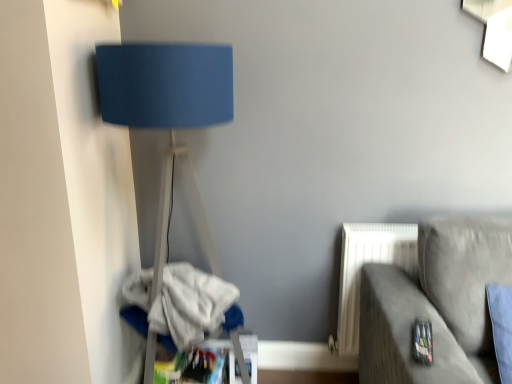
Question: Should I look upward or downward to see white cotton laundry at lower left?

Choices:
 (A) down
 (B) up

Answer: (A)

Question: Considering the relative positions of suede gray couch at lower right and matte blue lampshade at left in the image provided, is suede gray couch at lower right behind matte blue lampshade at left?

Choices:
 (A) yes
 (B) no

Answer: (B)

Question: Is suede gray couch at lower right aimed at matte blue lampshade at left?

Choices:
 (A) no
 (B) yes

Answer: (A)

Question: From the image's perspective, is suede gray couch at lower right below matte blue lampshade at left?

Choices:
 (A) no
 (B) yes

Answer: (B)

Question: Does suede gray couch at lower right have a lesser width compared to matte blue lampshade at left?

Choices:
 (A) no
 (B) yes

Answer: (A)

Question: From the image's perspective, would you say suede gray couch at lower right is positioned over matte blue lampshade at left?

Choices:
 (A) yes
 (B) no

Answer: (B)

Question: Does suede gray couch at lower right have a greater width compared to matte blue lampshade at left?

Choices:
 (A) no
 (B) yes

Answer: (B)

Question: Can you confirm if white cotton laundry at lower left is shorter than matte blue lampshade at left?

Choices:
 (A) yes
 (B) no

Answer: (A)

Question: Is white cotton laundry at lower left positioned behind matte blue lampshade at left?

Choices:
 (A) no
 (B) yes

Answer: (B)

Question: Does white cotton laundry at lower left have a greater height compared to matte blue lampshade at left?

Choices:
 (A) no
 (B) yes

Answer: (A)

Question: Does white cotton laundry at lower left appear on the right side of matte blue lampshade at left?

Choices:
 (A) yes
 (B) no

Answer: (B)

Question: From the image's perspective, is white cotton laundry at lower left below matte blue lampshade at left?

Choices:
 (A) yes
 (B) no

Answer: (A)

Question: Is white cotton laundry at lower left looking in the opposite direction of matte blue lampshade at left?

Choices:
 (A) yes
 (B) no

Answer: (A)

Question: From a real-world perspective, is matte blue lampshade at left physically below suede gray couch at lower right?

Choices:
 (A) no
 (B) yes

Answer: (A)